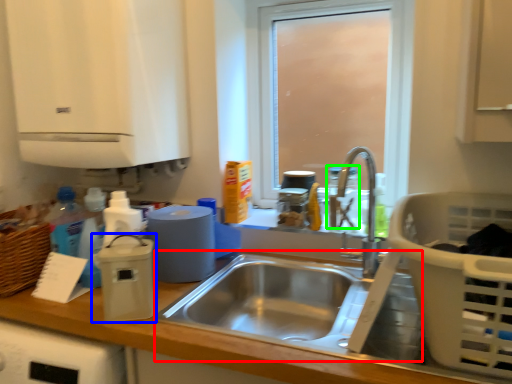
Question: Estimate the real-world distances between objects in this image. Which object is farther from sink (highlighted by a red box), appliance (highlighted by a blue box) or bottle (highlighted by a green box)?

Choices:
 (A) appliance
 (B) bottle

Answer: (B)